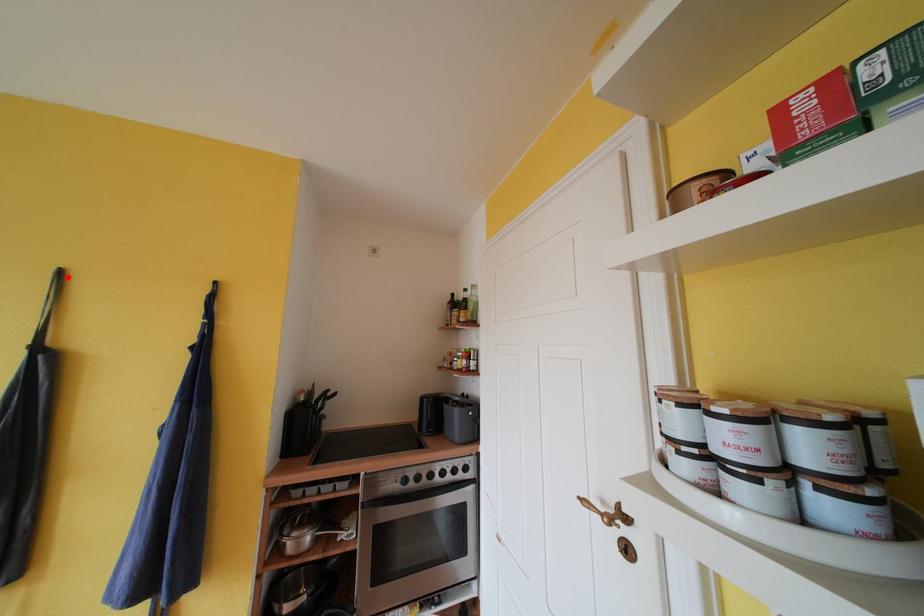
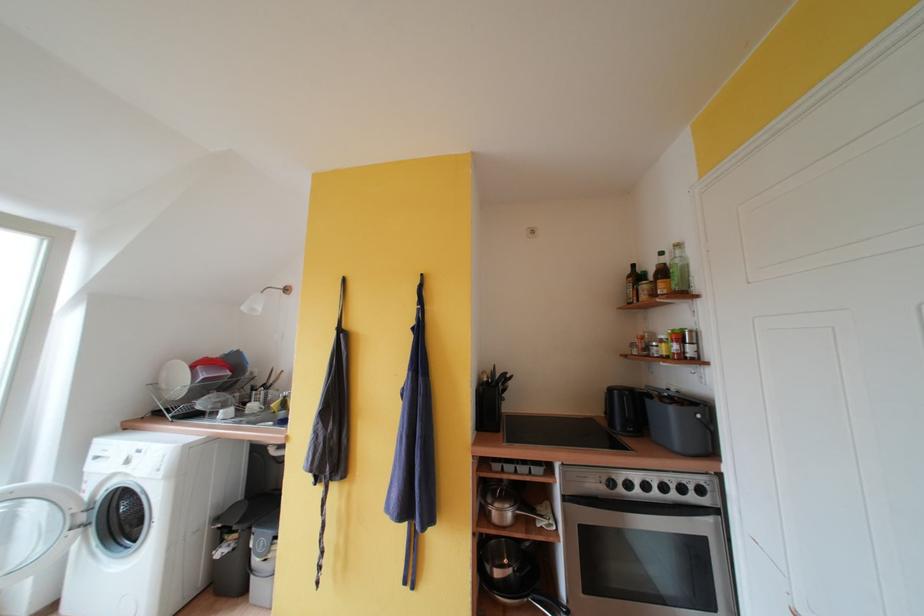
Locate, in the second image, the point that corresponds to the highlighted location in the first image.

(350, 284)